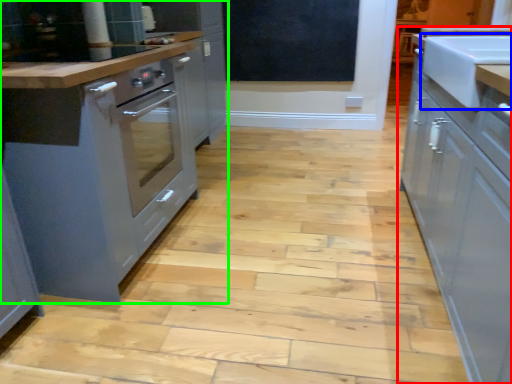
Question: Which object is the farthest from cabinetry (highlighted by a red box)? Choose among these: sink (highlighted by a blue box) or cabinetry (highlighted by a green box).

Choices:
 (A) sink
 (B) cabinetry

Answer: (B)